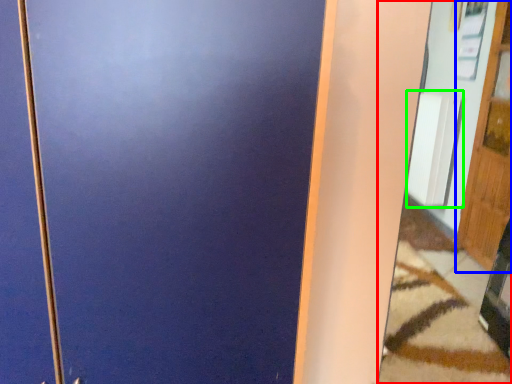
Question: Considering the real-world distances, which object is closest to mirror (highlighted by a red box)? door (highlighted by a blue box) or radiator (highlighted by a green box).

Choices:
 (A) door
 (B) radiator

Answer: (A)